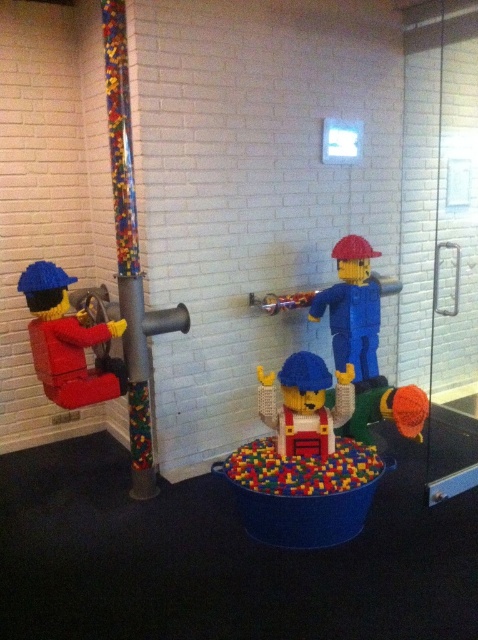
You are a LEGO enthusiast who wants to build a tower using the figures as part of the structure. Which figure should you place first if you want the matte red brick figure at left to be on the left side of the matte blue construction worker at center?

You should place the matte red brick figure at left first because it needs to be positioned on the left side of the matte blue construction worker at center.